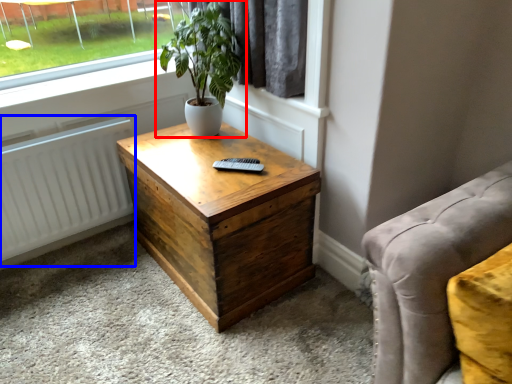
Question: Which point is further to the camera, houseplant (highlighted by a red box) or radiator (highlighted by a blue box)?

Choices:
 (A) houseplant
 (B) radiator

Answer: (B)